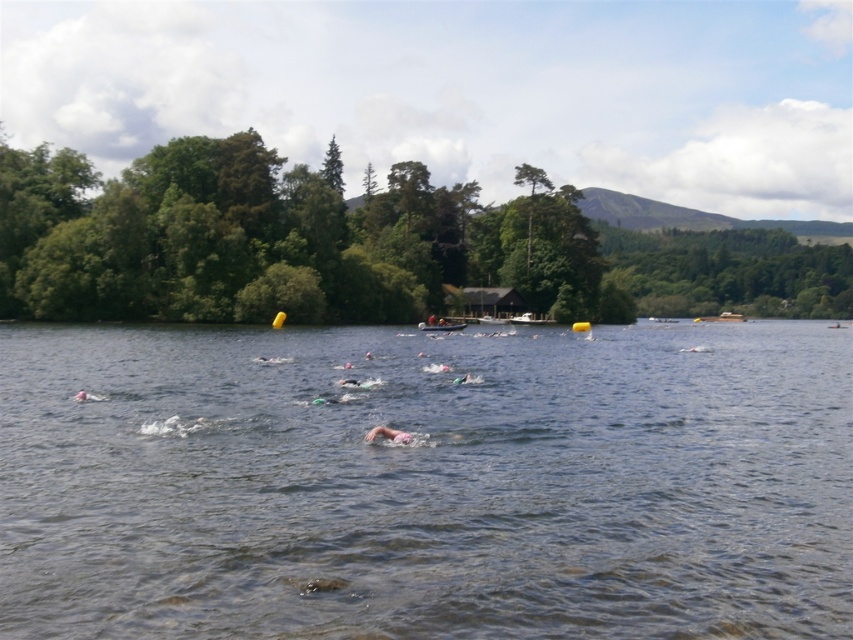
Question: Is pink swim cap at center behind white plastic boat at center?

Choices:
 (A) yes
 (B) no

Answer: (B)

Question: Is clear water at center to the left of white plastic boat at center from the viewer's perspective?

Choices:
 (A) no
 (B) yes

Answer: (A)

Question: Which point is closer to the camera?

Choices:
 (A) (404, 442)
 (B) (775, 436)

Answer: (A)

Question: Among these points, which one is nearest to the camera?

Choices:
 (A) (448, 330)
 (B) (61, 410)
 (C) (405, 442)

Answer: (C)

Question: Does pink swim cap at center come behind white plastic boat at center?

Choices:
 (A) yes
 (B) no

Answer: (B)

Question: Which object is farther from the camera taking this photo?

Choices:
 (A) pink swim cap at center
 (B) white plastic boat at center

Answer: (B)